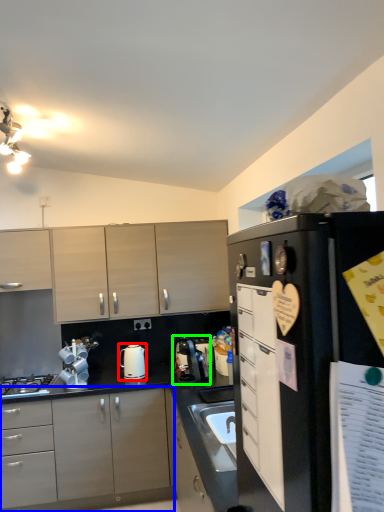
Question: Based on their relative distances, which object is farther from kitchen appliance (highlighted by a red box)? Choose from cabinetry (highlighted by a blue box) and coffee machine (highlighted by a green box).

Choices:
 (A) cabinetry
 (B) coffee machine

Answer: (A)